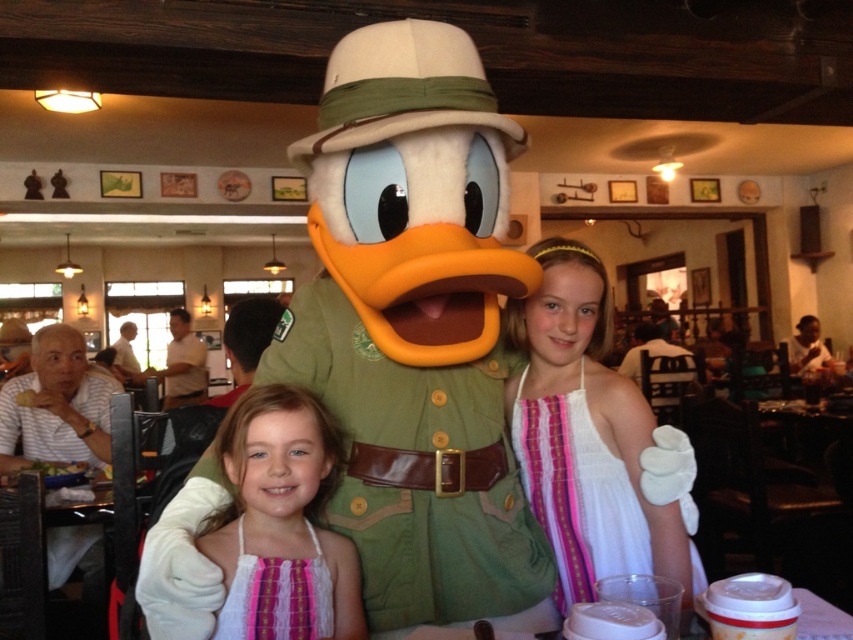
Question: Which point is closer to the camera?

Choices:
 (A) pink lace dress at center
 (B) translucent plastic cups at lower center

Answer: (B)

Question: Which point appears farthest from the camera in this image?

Choices:
 (A) (433, 634)
 (B) (277, 403)

Answer: (B)

Question: Is pink woven dress at center to the left of translucent plastic cups at lower center from the viewer's perspective?

Choices:
 (A) yes
 (B) no

Answer: (A)

Question: Can you confirm if pink lace dress at center is wider than translucent plastic cups at lower center?

Choices:
 (A) no
 (B) yes

Answer: (B)

Question: Can you confirm if white sheer dress at center is positioned above pink woven dress at center?

Choices:
 (A) no
 (B) yes

Answer: (B)

Question: Which object appears closest to the camera in this image?

Choices:
 (A) translucent plastic cups at lower center
 (B) pink lace dress at center
 (C) pink woven dress at center
 (D) white sheer dress at center

Answer: (A)